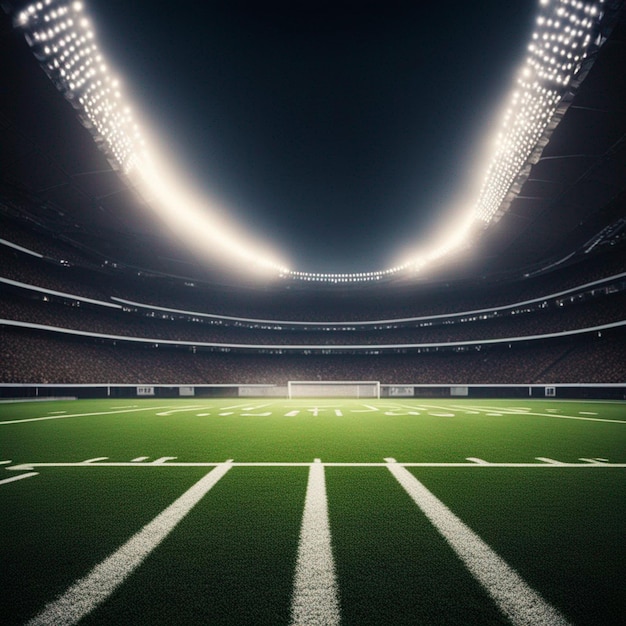
Locate an element on the screen. The image size is (626, 626). seating tiers is located at coordinates (295, 307), (289, 331), (273, 361).